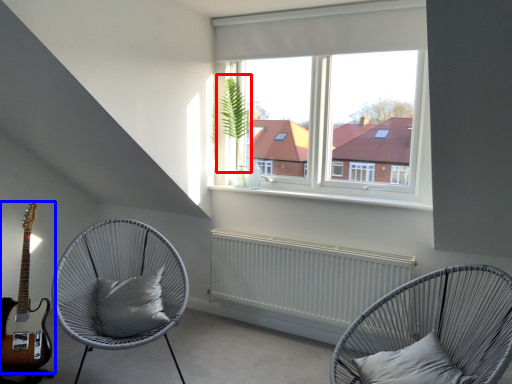
Question: Which object appears farthest to the camera in this image, plant (highlighted by a red box) or guitar (highlighted by a blue box)?

Choices:
 (A) plant
 (B) guitar

Answer: (A)